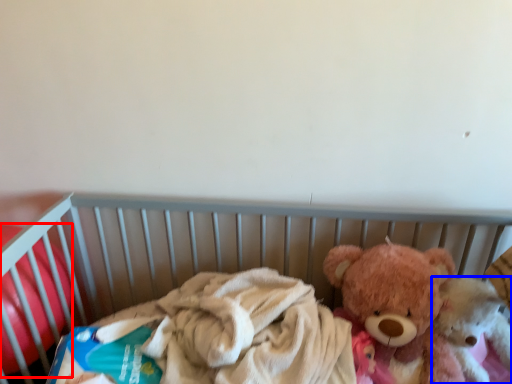
Question: Among these objects, which one is nearest to the camera, toy (highlighted by a red box) or teddy bear (highlighted by a blue box)?

Choices:
 (A) toy
 (B) teddy bear

Answer: (A)